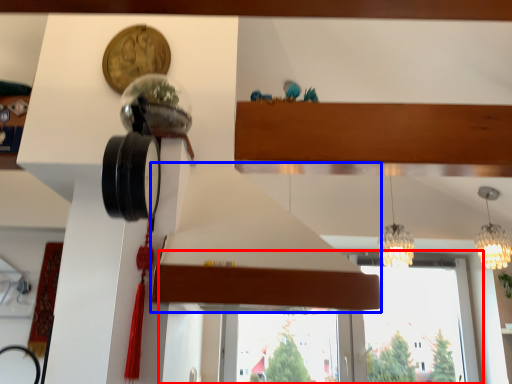
Question: Which object is closer to the camera taking this photo, window (highlighted by a red box) or exhaust hood (highlighted by a blue box)?

Choices:
 (A) window
 (B) exhaust hood

Answer: (B)